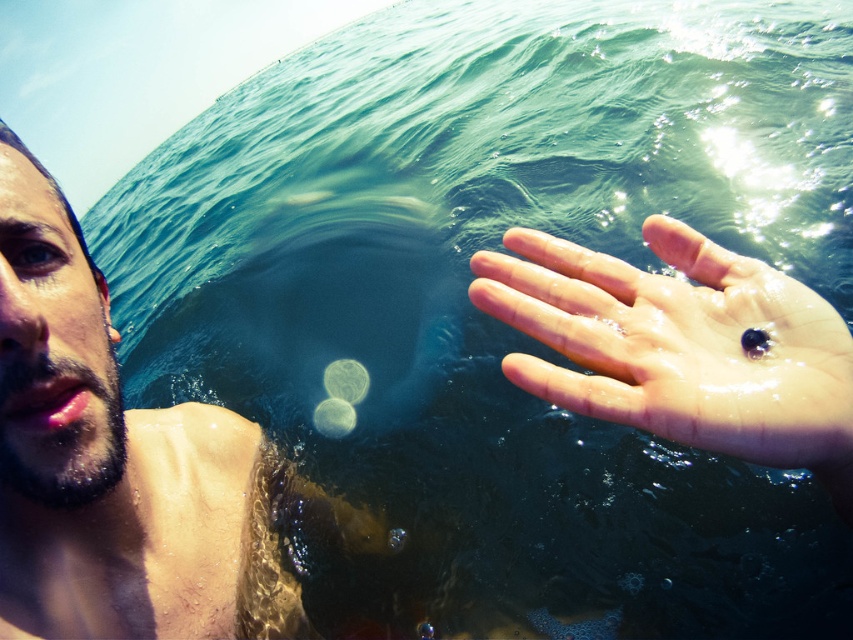
In the scene shown: Is shiny wet skin at left behind glossy skin hand at right?

That is True.

Does shiny wet skin at left have a larger size compared to glossy skin hand at right?

Indeed, shiny wet skin at left has a larger size compared to glossy skin hand at right.

Which is behind, point (279, 602) or point (689, 440)?

The point (279, 602) is behind.

Where is `shiny wet skin at left`? shiny wet skin at left is located at coordinates (113, 461).